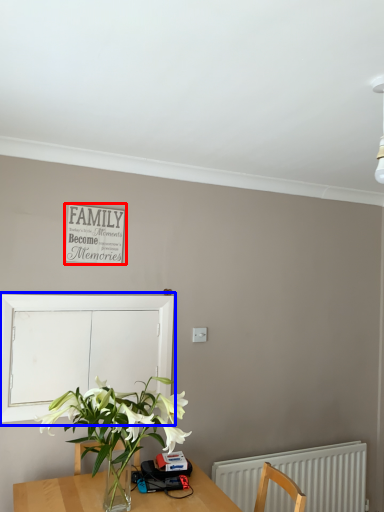
Question: Which object is closer to the camera taking this photo, bulletin board (highlighted by a red box) or window screen (highlighted by a blue box)?

Choices:
 (A) bulletin board
 (B) window screen

Answer: (B)